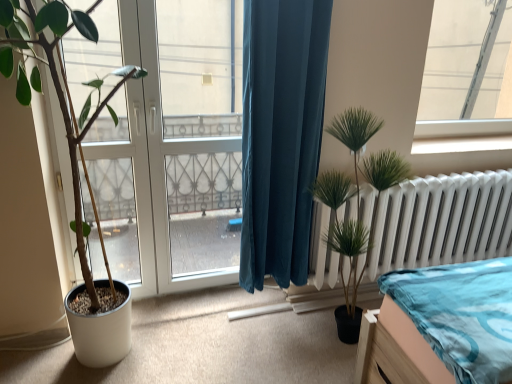
This screenshot has height=384, width=512. In order to click on vacant space to the right of transparent glass door at left in this screenshot , I will do `click(232, 318)`.